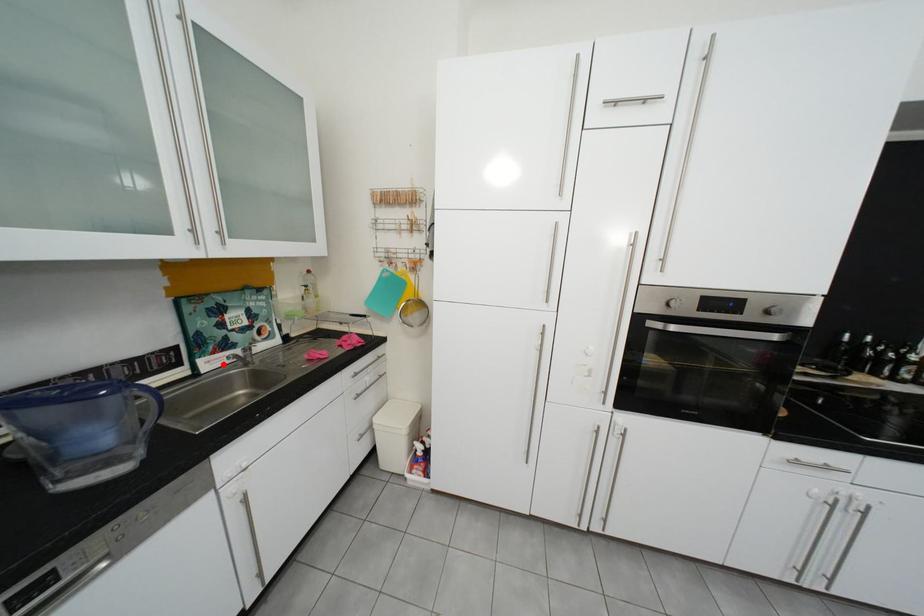
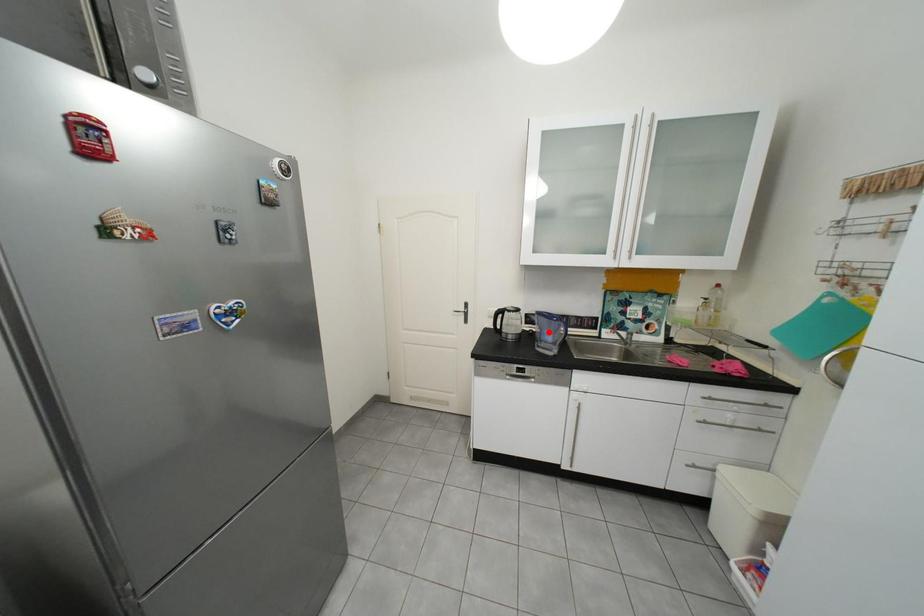
I am providing you with two images of the same scene from different viewpoints. A red point is marked on the first image and another point is marked on the second image. Do the highlighted points in image1 and image2 indicate the same real-world spot?

No